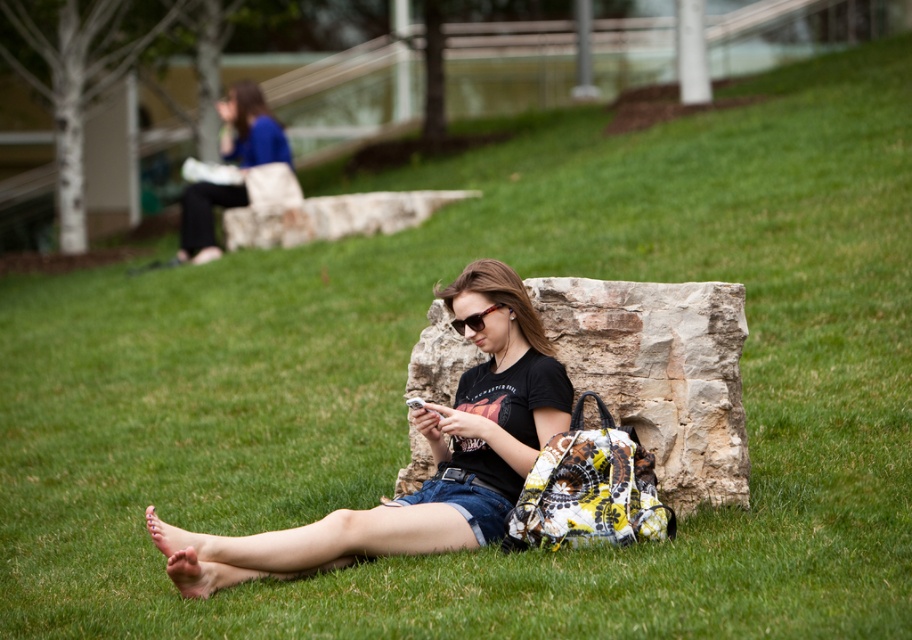
Between point (457, 529) and point (230, 104), which one is positioned behind?

Positioned behind is point (230, 104).

Does black matte t-shirt at center appear on the right side of blue fabric bag at upper left?

Yes, black matte t-shirt at center is to the right of blue fabric bag at upper left.

Who is more forward, (570, 404) or (258, 131)?

Point (570, 404) is more forward.

Identify the location of black matte t-shirt at center. The width and height of the screenshot is (912, 640). (432, 454).

Who is higher up, blue fabric bag at upper left or translucent orange sunglasses at center?

blue fabric bag at upper left is higher up.

Does blue fabric bag at upper left appear over translucent orange sunglasses at center?

Indeed, blue fabric bag at upper left is positioned over translucent orange sunglasses at center.

Is point (183, 250) behind point (472, 328)?

Yes, it is behind point (472, 328).

At what (x,y) coordinates should I click in order to perform the action: click on blue fabric bag at upper left. Please return your answer as a coordinate pair (x, y). This screenshot has height=640, width=912. Looking at the image, I should click on (250, 125).

Based on the photo, who is more forward, (522, 448) or (470, 323)?

Point (522, 448) is more forward.

Can you confirm if black matte t-shirt at center is positioned to the left of translucent orange sunglasses at center?

Yes, black matte t-shirt at center is to the left of translucent orange sunglasses at center.

Measure the distance between point (203, 554) and camera.

A distance of 11.49 meters exists between point (203, 554) and camera.

Locate an element on the screen. Image resolution: width=912 pixels, height=640 pixels. black matte t-shirt at center is located at coordinates (432, 454).